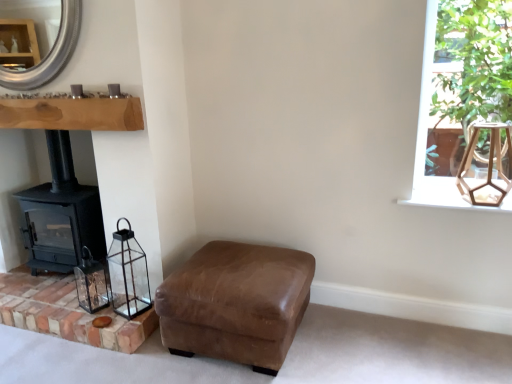
The image size is (512, 384). What are the coordinates of `vacant space in front of clear glass lantern at lower left, the 2th lamp from the top` in the screenshot? It's located at (116, 319).